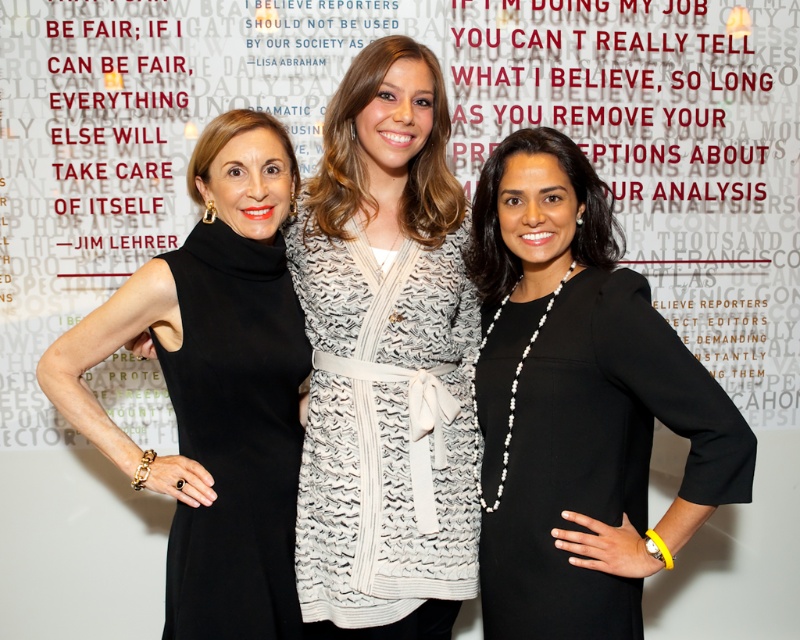
Does point (198, 484) lie behind point (408, 419)?

That is False.

Can you confirm if black sleeveless dress at left is shorter than white textured sweater at center?

In fact, black sleeveless dress at left may be taller than white textured sweater at center.

Is point (202, 250) positioned behind point (350, 285)?

No, it is not.

Locate an element on the screen. black sleeveless dress at left is located at coordinates pyautogui.click(x=216, y=387).

Which is in front, point (744, 461) or point (393, 476)?

Point (744, 461)

Can you confirm if black satin dress at center is positioned above white textured sweater at center?

Indeed, black satin dress at center is positioned over white textured sweater at center.

The width and height of the screenshot is (800, 640). What do you see at coordinates (578, 403) in the screenshot?
I see `black satin dress at center` at bounding box center [578, 403].

The width and height of the screenshot is (800, 640). Identify the location of black satin dress at center. (578, 403).

Between white textured sweater at center and black matte dress at left, which one appears on the left side from the viewer's perspective?

black matte dress at left

In the scene shown: Is the position of white textured sweater at center more distant than that of black matte dress at left?

Yes, it is.

This screenshot has height=640, width=800. In order to click on white textured sweater at center in this screenshot , I will do `click(384, 426)`.